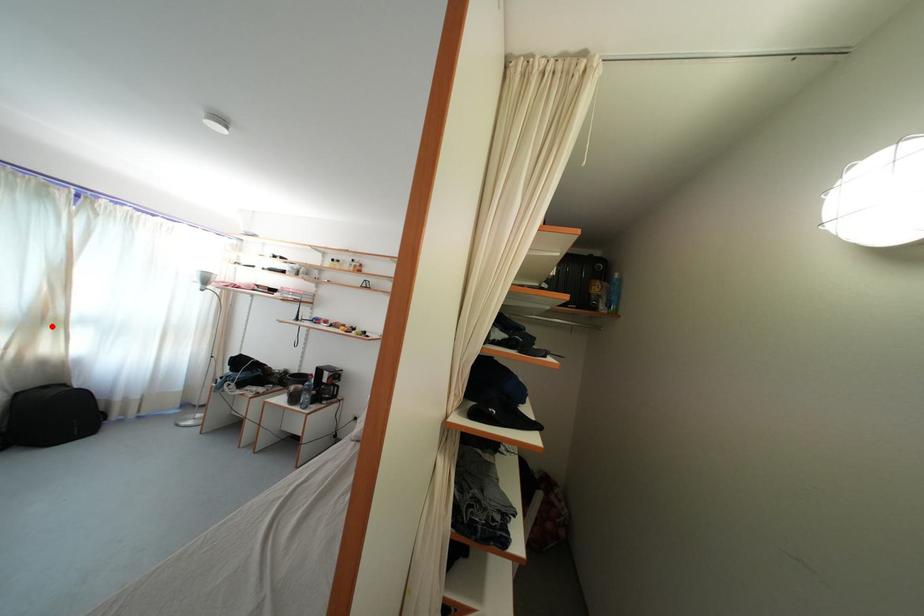
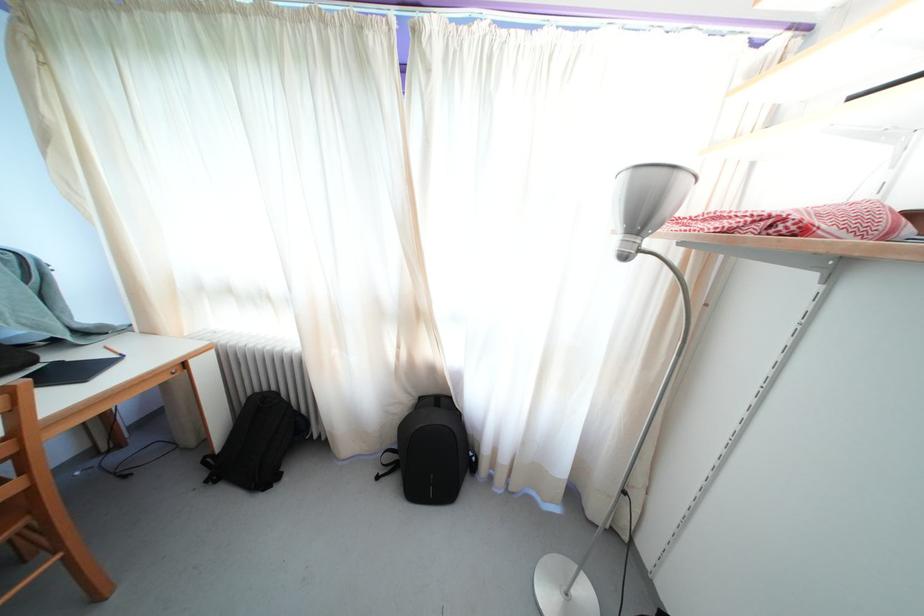
Find the pixel in the second image that matches the highlighted location in the first image.

(421, 321)